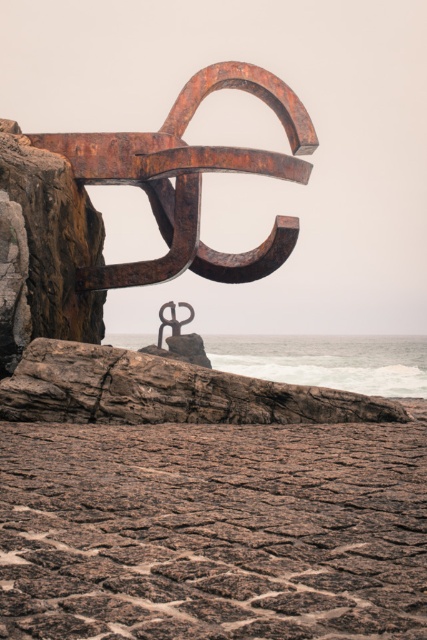
You are standing on the walkway leading to the sculpture and want to take a photo. There are two points of interest marked as point 1 at coordinates point (321, 515) and point 2 at coordinates point (158, 188). Which point should you focus on to capture the sculpture in the foreground and the distant landscape in the background?

You should focus on point 2 at coordinates point (158, 188) because it is farther from the viewer, allowing the sculpture in the foreground and the distant landscape to be captured in the background.

You are a tourist standing on the rusty stone beach at lower center and want to reach the rusty metal anchor at center. Which direction should you move to get there?

The rusty stone beach at lower center is positioned on the left side of the rusty metal anchor at center, so you should move to the right to reach the rusty metal anchor at center.